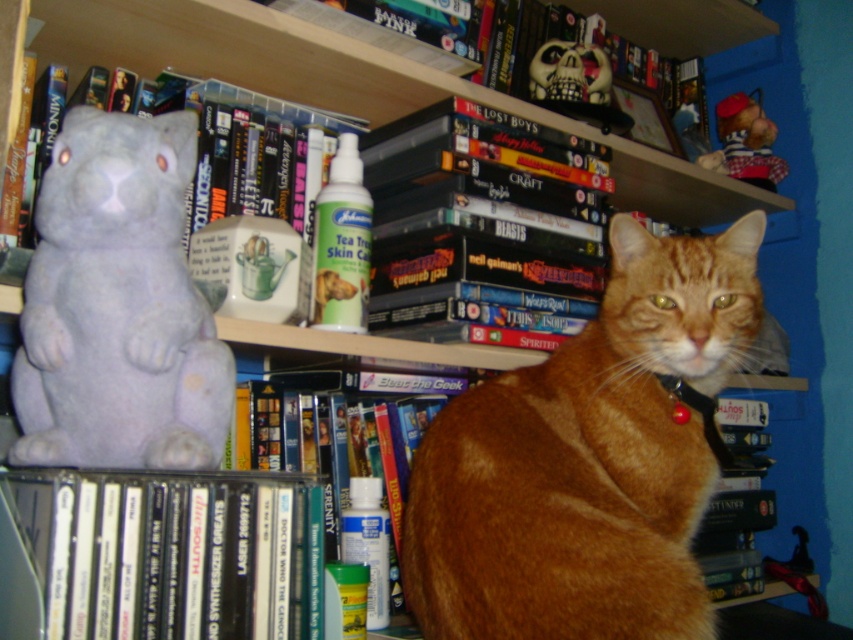
This screenshot has height=640, width=853. In order to click on orange fur cat at center in this screenshot , I will do `click(589, 460)`.

Is orange fur cat at center above red plastic collar at center?

No, orange fur cat at center is not above red plastic collar at center.

Is point (595, 538) less distant than point (694, 397)?

Yes, point (595, 538) is closer to viewer.

Where is `orange fur cat at center`? orange fur cat at center is located at coordinates (589, 460).

Between purple fabric stuffed animal at left and hardcover book at center, which one has more height?

Standing taller between the two is hardcover book at center.

Can you confirm if purple fabric stuffed animal at left is shorter than hardcover book at center?

Yes, purple fabric stuffed animal at left is shorter than hardcover book at center.

The height and width of the screenshot is (640, 853). Describe the element at coordinates (119, 307) in the screenshot. I see `purple fabric stuffed animal at left` at that location.

You are a GUI agent. You are given a task and a screenshot of the screen. Output one action in this format:
    pyautogui.click(x=<x>, y=<y>)
    Task: Click on the purple fabric stuffed animal at left
    
    Given the screenshot: What is the action you would take?
    pyautogui.click(x=119, y=307)

Based on the photo, who is positioned more to the right, white ceramic bear at left or red plastic collar at center?

From the viewer's perspective, red plastic collar at center appears more on the right side.

In the scene shown: Who is positioned more to the left, white ceramic bear at left or red plastic collar at center?

white ceramic bear at left is more to the left.

Find the location of a particular element. white ceramic bear at left is located at coordinates (247, 152).